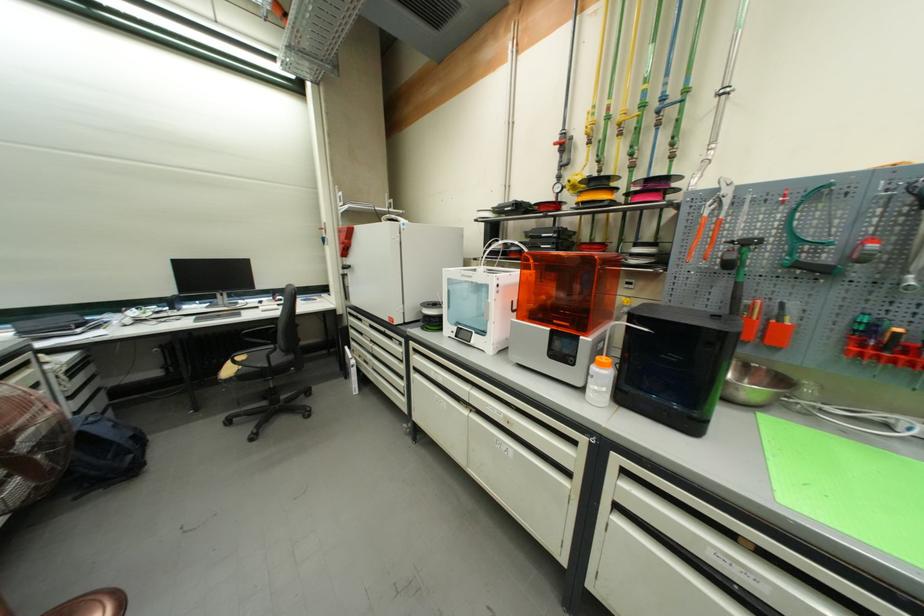
Which object does [600,381] point to?

It corresponds to the white plastic bottle in the image.